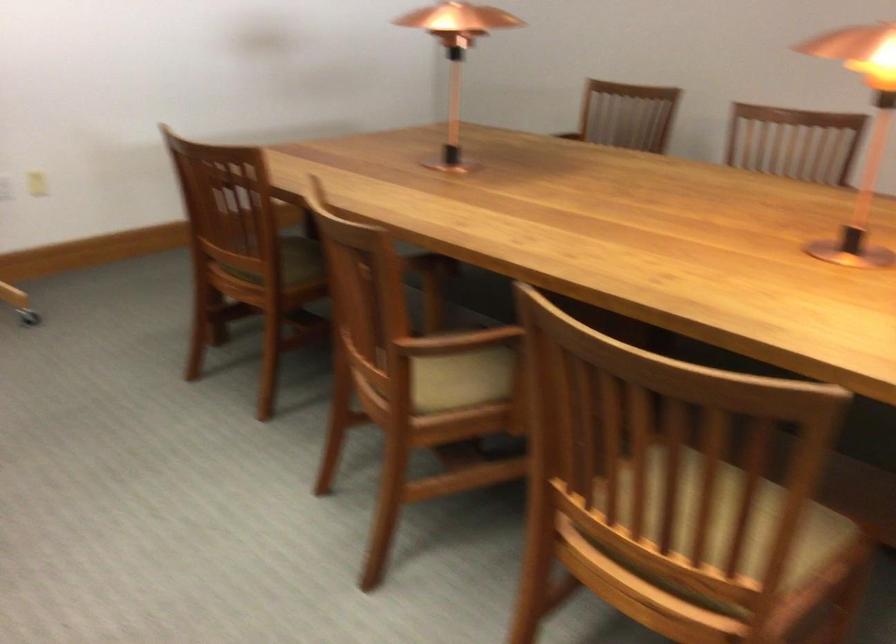
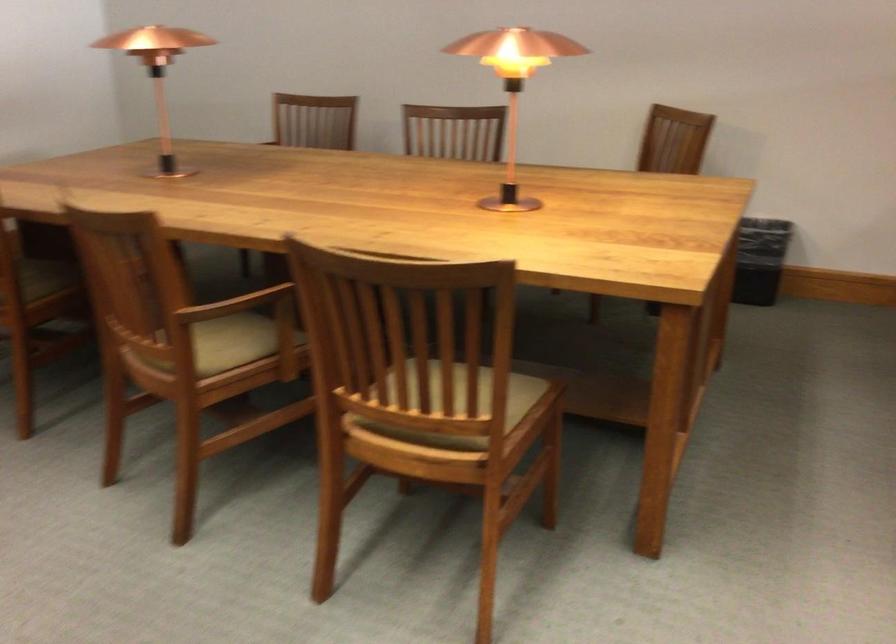
Question: I am providing you with two images of the same scene from different viewpoints. Which of the following objects are not visible in image2?

Choices:
 (A) wooden chair armrest
 (B) copper table lamp
 (C) light brown chair sitting surface
 (D) none of these

Answer: (D)